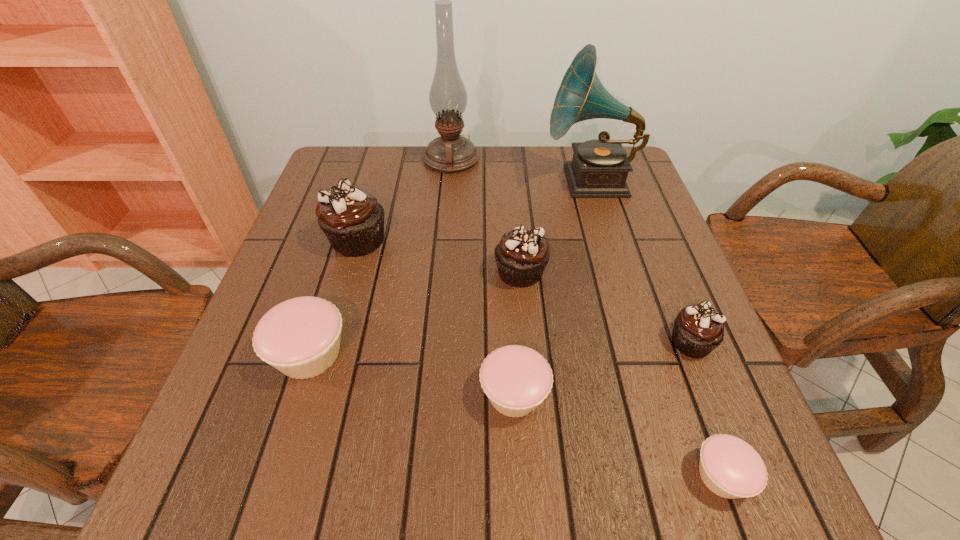
Select which cupcake is the fourth closest to the second pink cupcake from left to right. Please provide its 2D coordinates. Your answer should be formatted as a tuple, i.e. [(x, y)], where the tuple contains the x and y coordinates of a point satisfying the conditions above.

[(300, 337)]

This screenshot has width=960, height=540. In order to click on brown cupcake that stands as the second closest to the biggest brown cupcake in this screenshot , I will do `click(698, 329)`.

Find the location of a particular element. brown cupcake object that ranks as the third closest to the rightmost pink cupcake is located at coordinates (352, 219).

The height and width of the screenshot is (540, 960). In order to click on pink cupcake that can be found as the second closest to the second shortest object in this screenshot , I will do `click(300, 337)`.

In order to click on pink cupcake that is the closest to the rightmost brown cupcake in this screenshot , I will do `click(731, 468)`.

You are a GUI agent. You are given a task and a screenshot of the screen. Output one action in this format:
    pyautogui.click(x=<x>, y=<y>)
    Task: Click on the vacant area in the image that satisfies the following two spatial constraints: 1. on the front side of the second shortest object; 2. on the left side of the biggest brown cupcake
    The width and height of the screenshot is (960, 540).
    Given the screenshot: What is the action you would take?
    pyautogui.click(x=313, y=394)

This screenshot has width=960, height=540. In order to click on vacant position in the image that satisfies the following two spatial constraints: 1. on the back side of the nearest object; 2. on the left side of the smallest brown cupcake in this screenshot , I will do `click(673, 342)`.

I want to click on free space that satisfies the following two spatial constraints: 1. on the front side of the nearest object; 2. on the right side of the bronze oil lamp, so coord(424,476).

The width and height of the screenshot is (960, 540). I want to click on vacant area that satisfies the following two spatial constraints: 1. on the front side of the rightmost brown cupcake; 2. on the right side of the sixth shortest object, so click(x=328, y=342).